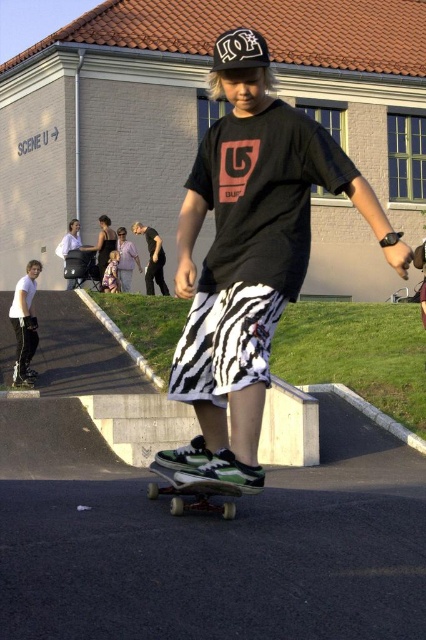
You are looking at the skate park scene and notice a point marked at coordinates (250, 256). What object is located exactly at that point?

The zebra patterned shorts at center are located exactly at point (250, 256).